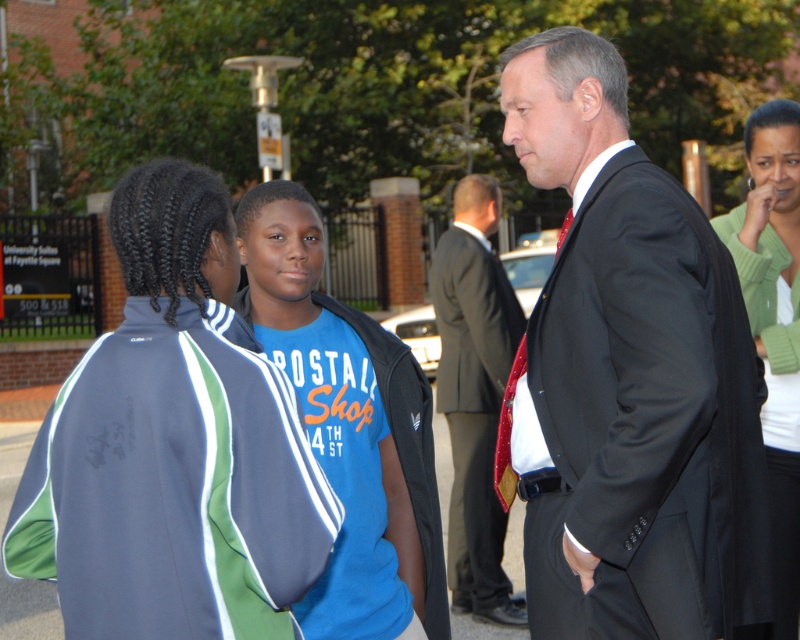
Question: Is blue fleece jacket at center thinner than green sweater at upper right?

Choices:
 (A) yes
 (B) no

Answer: (B)

Question: Considering the real-world distances, which object is farthest from the dark suit at center?

Choices:
 (A) blue cotton shirt at center
 (B) green sweater at upper right
 (C) shiny black suit at center

Answer: (C)

Question: Observing the image, what is the correct spatial positioning of dark suit at center in reference to green sweater at upper right?

Choices:
 (A) above
 (B) below

Answer: (B)

Question: Estimate the real-world distances between objects in this image. Which object is farther from the blue fleece jacket at center?

Choices:
 (A) blue cotton shirt at center
 (B) green sweater at upper right

Answer: (B)

Question: Is blue cotton shirt at center smaller than dark suit at center?

Choices:
 (A) yes
 (B) no

Answer: (A)

Question: Which of these objects is positioned closest to the dark suit at center?

Choices:
 (A) shiny black suit at center
 (B) blue fleece jacket at center

Answer: (A)